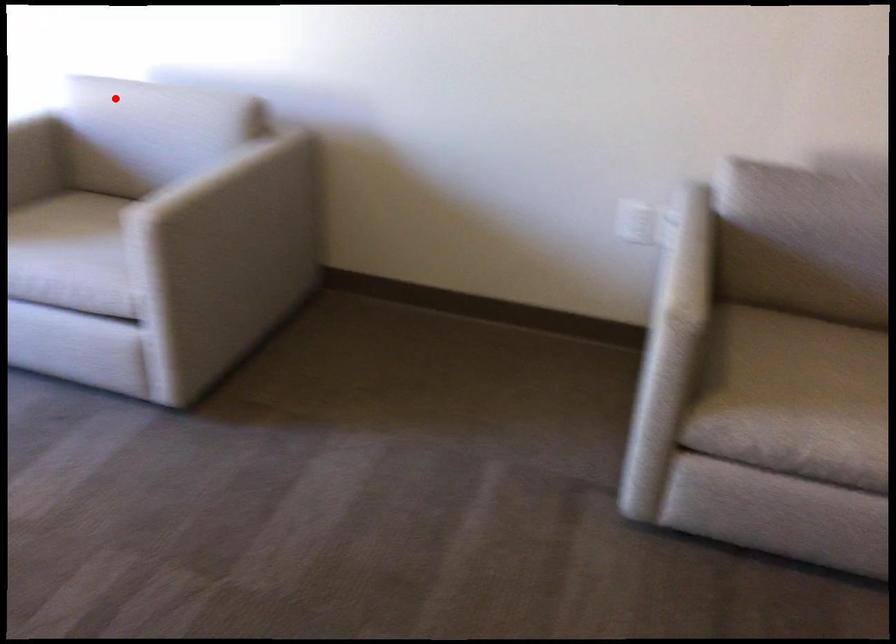
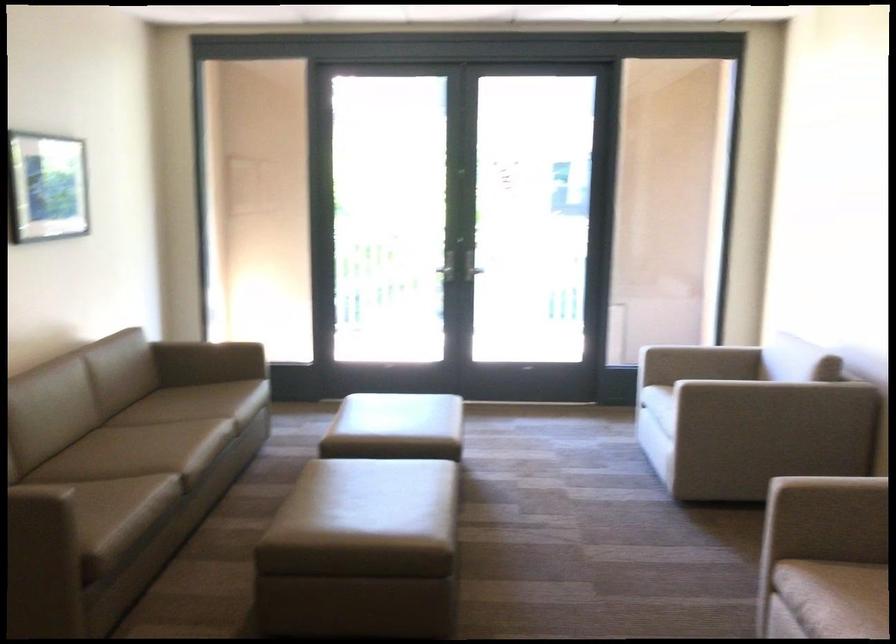
Where in the second image is the point corresponding to the highlighted location from the first image?

(762, 346)